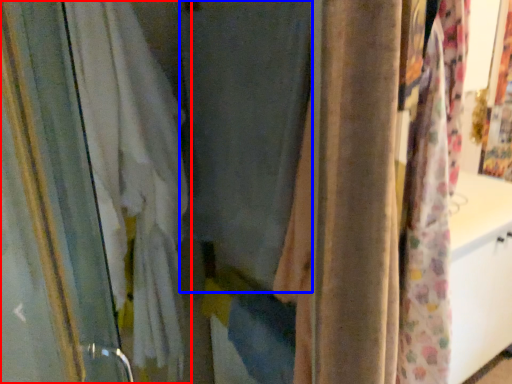
Question: Which object appears closest to the camera in this image, curtain (highlighted by a red box) or curtain (highlighted by a blue box)?

Choices:
 (A) curtain
 (B) curtain

Answer: (B)